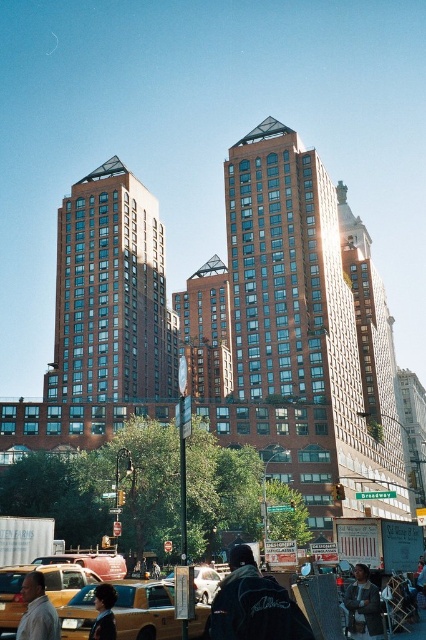
In the scene shown: Which is more to the left, light beige shirt at lower left or shiny black hair at center?

From the viewer's perspective, light beige shirt at lower left appears more on the left side.

From the picture: Which is above, light beige shirt at lower left or shiny black hair at center?

shiny black hair at center

Does point (46, 630) come behind point (112, 637)?

No.

Where is `light beige shirt at lower left`? light beige shirt at lower left is located at coordinates (37, 611).

Image resolution: width=426 pixels, height=640 pixels. Identify the location of black leather jacket at lower center. (253, 604).

Who is positioned more to the left, black leather jacket at lower center or yellow matte taxi at lower left?

Positioned to the left is yellow matte taxi at lower left.

Where is `black leather jacket at lower center`? black leather jacket at lower center is located at coordinates (253, 604).

Does yellow matte taxi at lower left appear under shiny black hair at center?

Yes.

Who is positioned more to the left, yellow matte taxi at lower left or shiny black hair at center?

yellow matte taxi at lower left

Who is more distant from viewer, (14,628) or (108,636)?

The point (14,628) is behind.

At what (x,y) coordinates should I click in order to perform the action: click on yellow matte taxi at lower left. Please return your answer as a coordinate pair (x, y). Image resolution: width=426 pixels, height=640 pixels. Looking at the image, I should click on (45, 586).